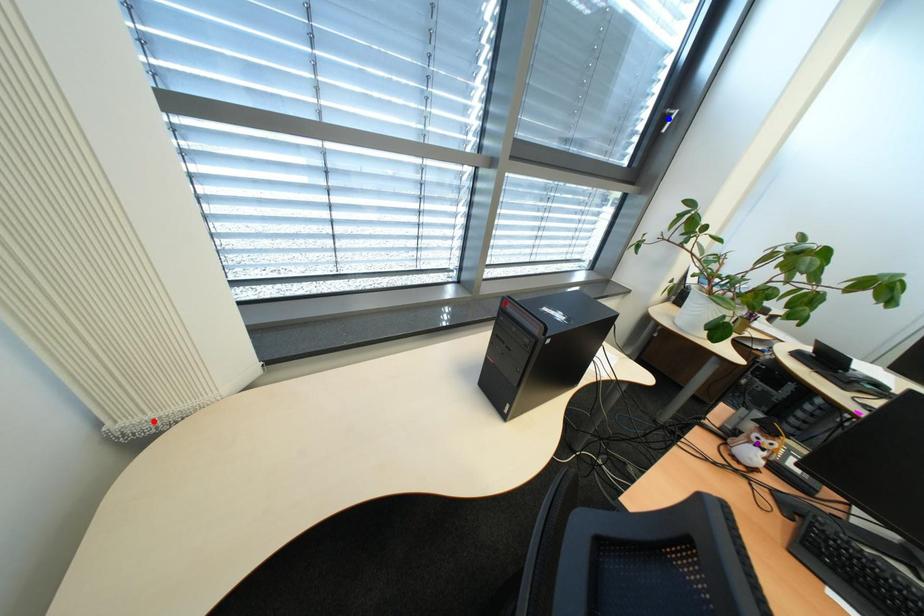
Order these from farthest to nearest:
purple point
blue point
red point

blue point < purple point < red point